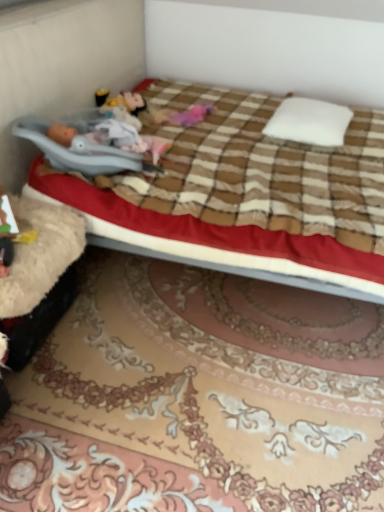
Locate an element on the screen. The image size is (384, 512). vacant point above white soft pillow at center (from a real-world perspective) is located at coordinates (303, 118).